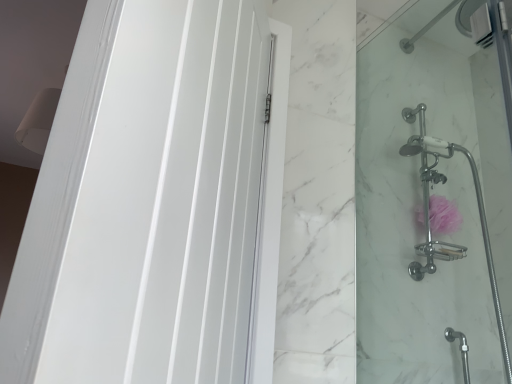
Question: From the image's perspective, is white glossy door at left above clear glass shower door at right?

Choices:
 (A) no
 (B) yes

Answer: (B)

Question: Is white glossy door at left next to clear glass shower door at right?

Choices:
 (A) no
 (B) yes

Answer: (A)

Question: Is white glossy door at left to the left of clear glass shower door at right from the viewer's perspective?

Choices:
 (A) no
 (B) yes

Answer: (B)

Question: Would you consider white glossy door at left to be distant from clear glass shower door at right?

Choices:
 (A) no
 (B) yes

Answer: (A)

Question: Does white glossy door at left have a greater height compared to clear glass shower door at right?

Choices:
 (A) yes
 (B) no

Answer: (B)

Question: From the image's perspective, is white glossy door at left above or below clear glass shower door at right?

Choices:
 (A) below
 (B) above

Answer: (B)

Question: Relative to clear glass shower door at right, is white glossy door at left in front or behind?

Choices:
 (A) behind
 (B) front

Answer: (B)

Question: Does point (228, 109) appear closer or farther from the camera than point (448, 178)?

Choices:
 (A) farther
 (B) closer

Answer: (B)

Question: In terms of size, does white glossy door at left appear bigger or smaller than clear glass shower door at right?

Choices:
 (A) small
 (B) big

Answer: (A)

Question: From their relative heights in the image, would you say pink fabric sponge at right is taller or shorter than white glossy door at left?

Choices:
 (A) short
 (B) tall

Answer: (A)

Question: Is point (450, 208) closer or farther from the camera than point (92, 142)?

Choices:
 (A) closer
 (B) farther

Answer: (B)

Question: Relative to white glossy door at left, is pink fabric sponge at right in front or behind?

Choices:
 (A) front
 (B) behind

Answer: (B)

Question: Based on their sizes in the image, would you say pink fabric sponge at right is bigger or smaller than white glossy door at left?

Choices:
 (A) big
 (B) small

Answer: (B)

Question: Is clear glass shower door at right taller or shorter than white glossy door at left?

Choices:
 (A) tall
 (B) short

Answer: (A)

Question: Considering the positions of clear glass shower door at right and white glossy door at left in the image, is clear glass shower door at right wider or thinner than white glossy door at left?

Choices:
 (A) wide
 (B) thin

Answer: (B)